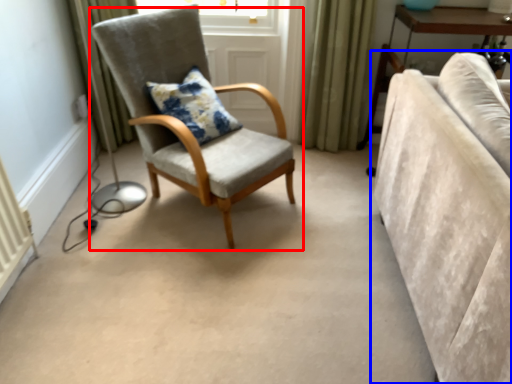
Question: Which point is closer to the camera, chair (highlighted by a red box) or studio couch (highlighted by a blue box)?

Choices:
 (A) chair
 (B) studio couch

Answer: (B)